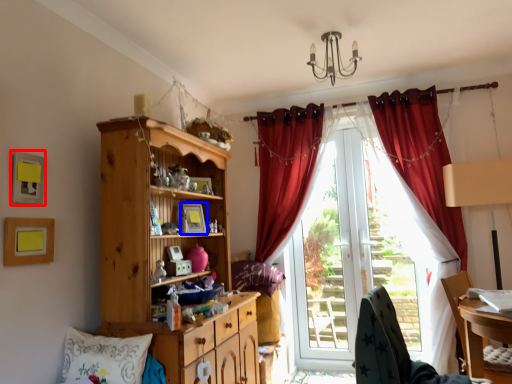
Question: Which point is further to the camera, picture frame (highlighted by a red box) or picture frame (highlighted by a blue box)?

Choices:
 (A) picture frame
 (B) picture frame

Answer: (B)